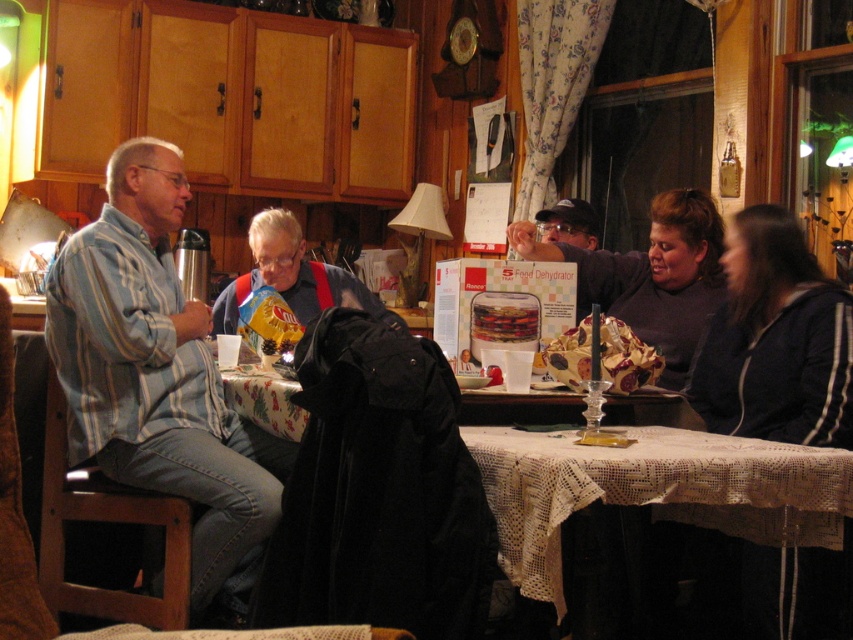
Which is more to the right, white lace tablecloth at lower right or denim jacket at center?

white lace tablecloth at lower right

Describe the element at coordinates (653, 490) in the screenshot. I see `white lace tablecloth at lower right` at that location.

Which is behind, point (811, 516) or point (294, 296)?

Point (294, 296)

Find the location of `white lace tablecloth at lower right`. white lace tablecloth at lower right is located at coordinates (653, 490).

Is point (674, 195) behind point (564, 221)?

No, (674, 195) is closer to viewer.

Is dark gray sweater at center taller than matte black cap at upper center?

Correct, dark gray sweater at center is much taller as matte black cap at upper center.

Locate an element on the screen. The image size is (853, 640). dark gray sweater at center is located at coordinates (651, 275).

Which is below, denim jacket at center or matte black cap at upper center?

Positioned lower is denim jacket at center.

Locate an element on the screen. The height and width of the screenshot is (640, 853). denim jacket at center is located at coordinates (292, 276).